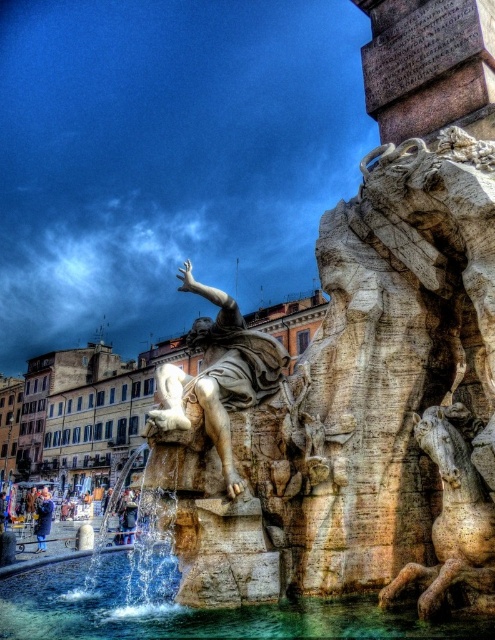
This screenshot has height=640, width=495. Describe the element at coordinates (186, 608) in the screenshot. I see `clear water at fountain center` at that location.

Does clear water at fountain center appear under blue wool coat at lower left?

No, clear water at fountain center is not below blue wool coat at lower left.

Which is behind, point (255, 624) or point (41, 531)?

The point (41, 531) is behind.

The height and width of the screenshot is (640, 495). Find the location of `clear water at fountain center`. clear water at fountain center is located at coordinates (186, 608).

Is stone statue at center bigger than carved stone horse at center?

Indeed, stone statue at center has a larger size compared to carved stone horse at center.

Is point (89, 108) closer to camera compared to point (466, 490)?

No, it is behind (466, 490).

The image size is (495, 640). I want to click on stone statue at center, so click(166, 157).

At what (x,y) coordinates should I click in order to perform the action: click on stone statue at center. Please return your answer as a coordinate pair (x, y). The height and width of the screenshot is (640, 495). Looking at the image, I should click on (166, 157).

Between point (467, 449) and point (195, 344), which one is positioned in front?

Point (467, 449)

Can you confirm if carved stone horse at center is wider than white marble statue at center?

No.

Find the location of a particular element. carved stone horse at center is located at coordinates (453, 515).